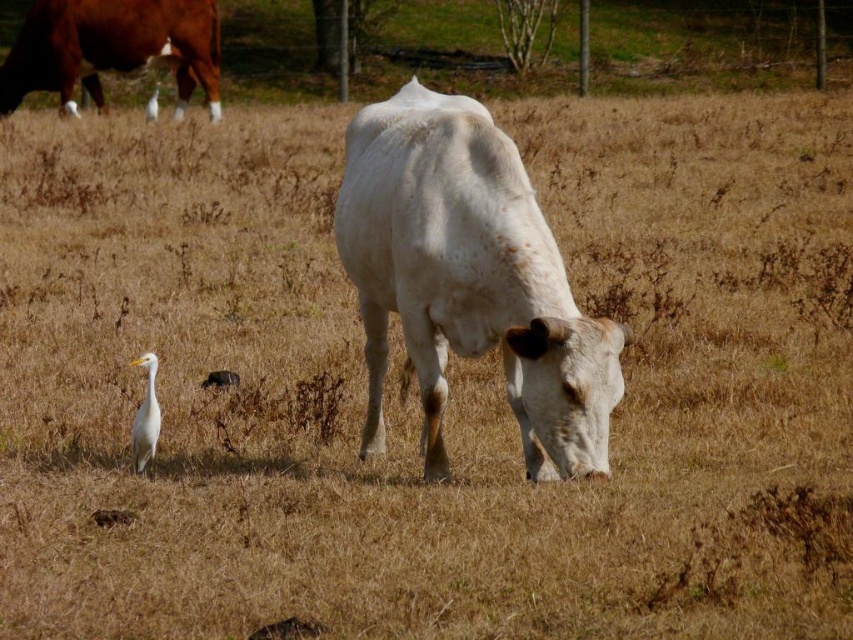
Is point (549, 452) positioned after point (154, 445)?

No, it is in front of (154, 445).

Does white smooth cow at center have a lesser height compared to white feathered bird at lower left?

No.

This screenshot has height=640, width=853. Describe the element at coordinates (469, 280) in the screenshot. I see `white smooth cow at center` at that location.

You are a GUI agent. You are given a task and a screenshot of the screen. Output one action in this format:
    pyautogui.click(x=<x>, y=<y>)
    Task: Click on the white smooth cow at center
    The image size is (853, 640).
    Given the screenshot: What is the action you would take?
    pyautogui.click(x=469, y=280)

Which of these two, white smooth cow at center or brown glossy bull at upper left, stands taller?

brown glossy bull at upper left

Does white smooth cow at center appear on the right side of brown glossy bull at upper left?

Yes, white smooth cow at center is to the right of brown glossy bull at upper left.

Image resolution: width=853 pixels, height=640 pixels. I want to click on white smooth cow at center, so 469,280.

Does brown glossy bull at upper left have a greater width compared to white feathered bird at lower left?

Yes.

The height and width of the screenshot is (640, 853). What do you see at coordinates (112, 49) in the screenshot? I see `brown glossy bull at upper left` at bounding box center [112, 49].

Does point (85, 60) lie behind point (148, 365)?

Yes.

This screenshot has width=853, height=640. Find the location of `brown glossy bull at upper left`. brown glossy bull at upper left is located at coordinates (112, 49).